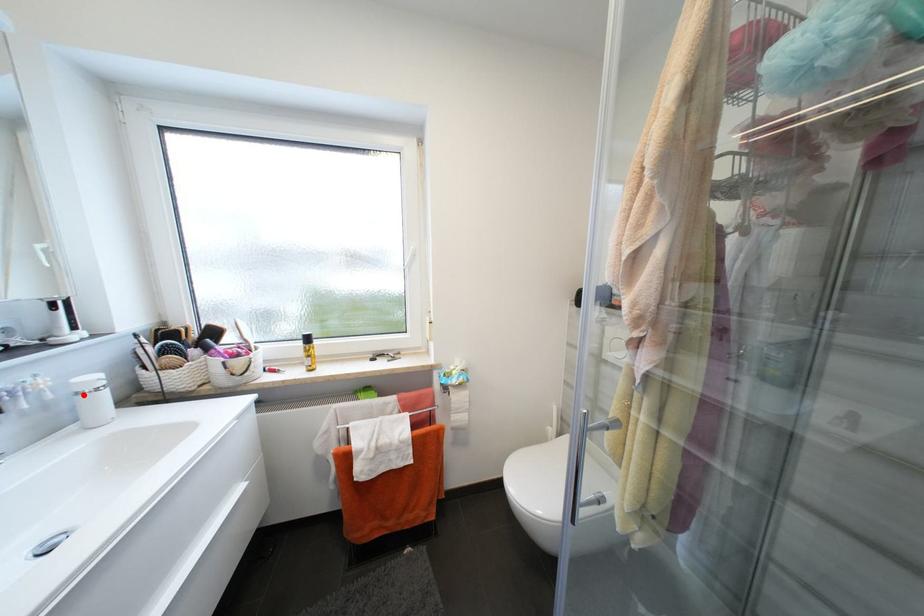
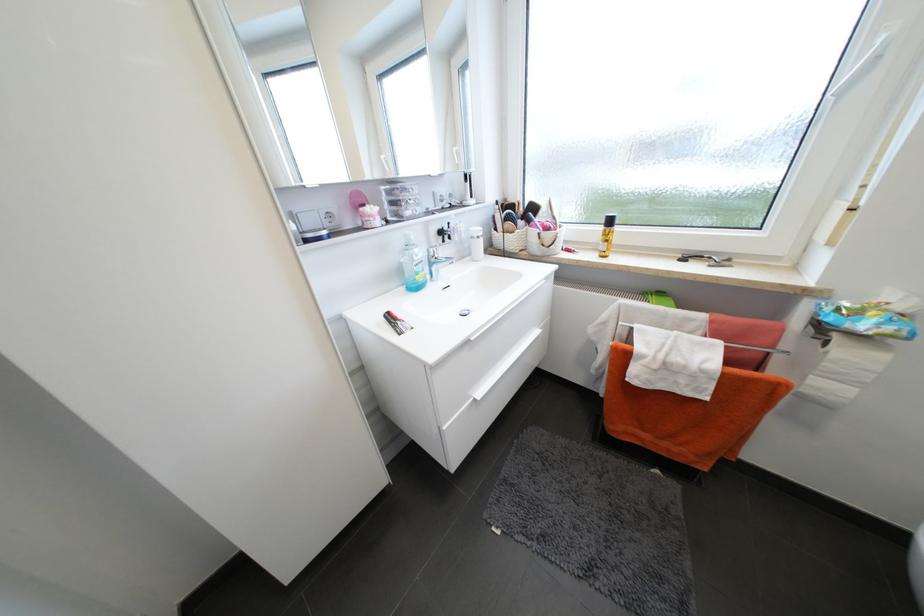
Find the pixel in the second image that matches the highlighted location in the first image.

(478, 238)